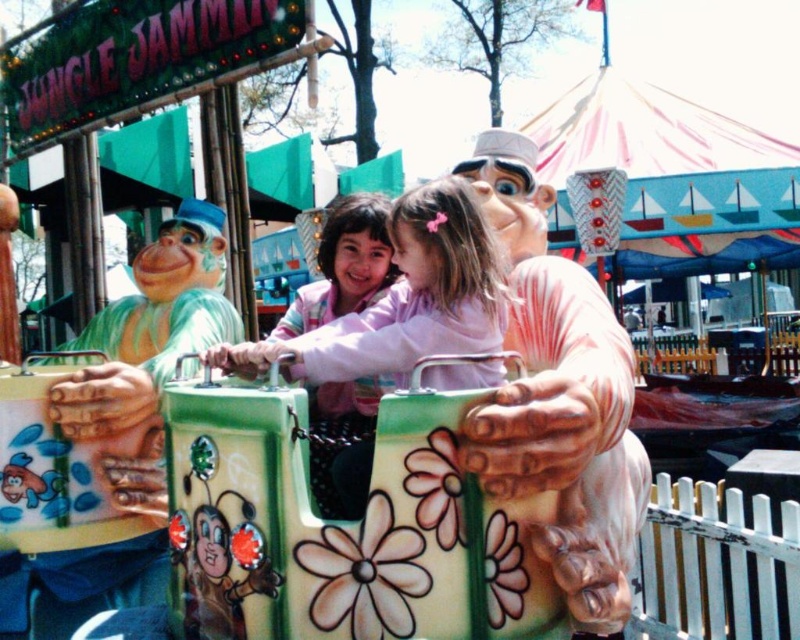
Which is behind, point (533, 340) or point (426, 195)?

The point (533, 340) is behind.

In the scene shown: Does matte pink plush monkey at center have a lesser width compared to pink matte jacket at center?

Indeed, matte pink plush monkey at center has a lesser width compared to pink matte jacket at center.

Identify the location of matte pink plush monkey at center. (560, 396).

Identify the location of matte pink plush monkey at center. (560, 396).